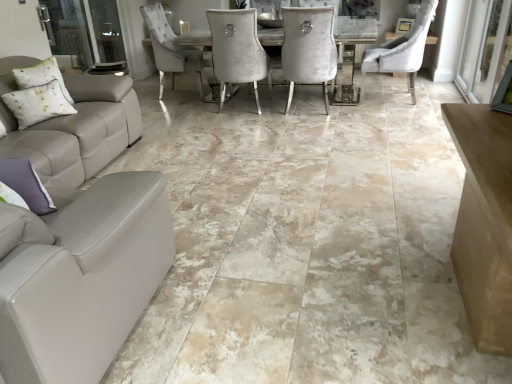
Identify the location of free spot in front of velvet beige chair at center, the first chair when ordered from right to left. Image resolution: width=512 pixels, height=384 pixels. (402, 113).